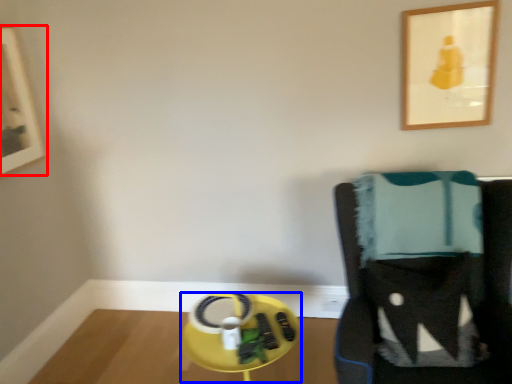
Question: Among these objects, which one is farthest to the camera, picture frame (highlighted by a red box) or round table (highlighted by a blue box)?

Choices:
 (A) picture frame
 (B) round table

Answer: (A)